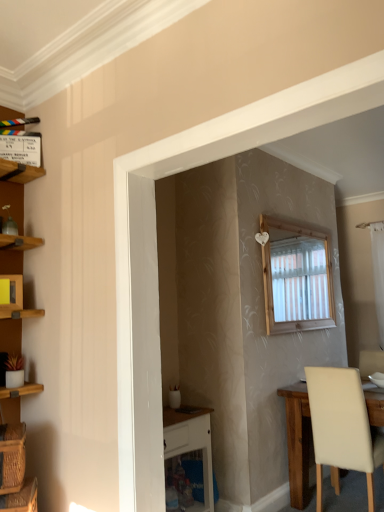
At what (x,y) coordinates should I click in order to perform the action: click on free space above white glossy vanity at lower center (from a real-world perspective). Please return your answer as a coordinate pair (x, y). Looking at the image, I should click on pos(178,412).